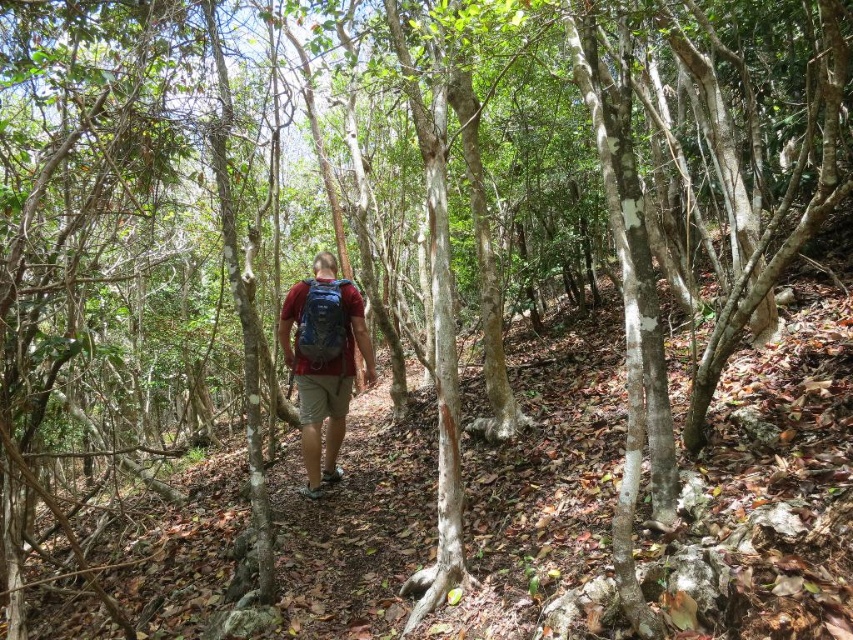
You are a hiker who has just arrived at the forest trail. You want to place your matte blue backpack at center exactly where you found it. What are the coordinates of the spot where you should place it?

The coordinates for the matte blue backpack at center are at point (323, 365).

You are the hiker in the image and want to place a marker at the point closer to your current position. Which point should you choose between point (328, 301) and point (334, 355)?

Point (328, 301) is in front of point (334, 355), so the closer point to your current position is point (328, 301).